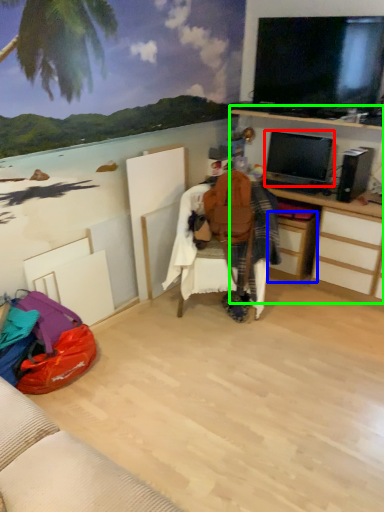
Question: Based on their relative distances, which object is farther from television (highlighted by a red box)? Choose from drawer (highlighted by a blue box) and computer desk (highlighted by a green box).

Choices:
 (A) drawer
 (B) computer desk

Answer: (A)